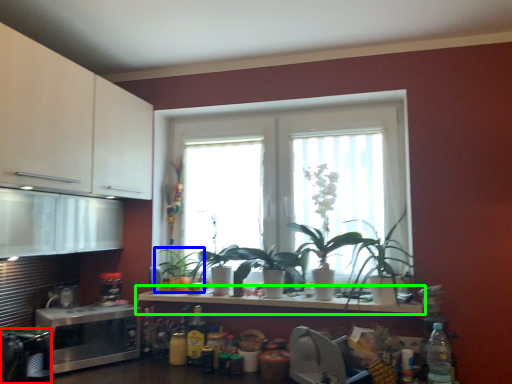
Question: Which is nearer to the appliance (highlighted by a red box)? houseplant (highlighted by a blue box) or countertop (highlighted by a green box).

Choices:
 (A) houseplant
 (B) countertop

Answer: (B)